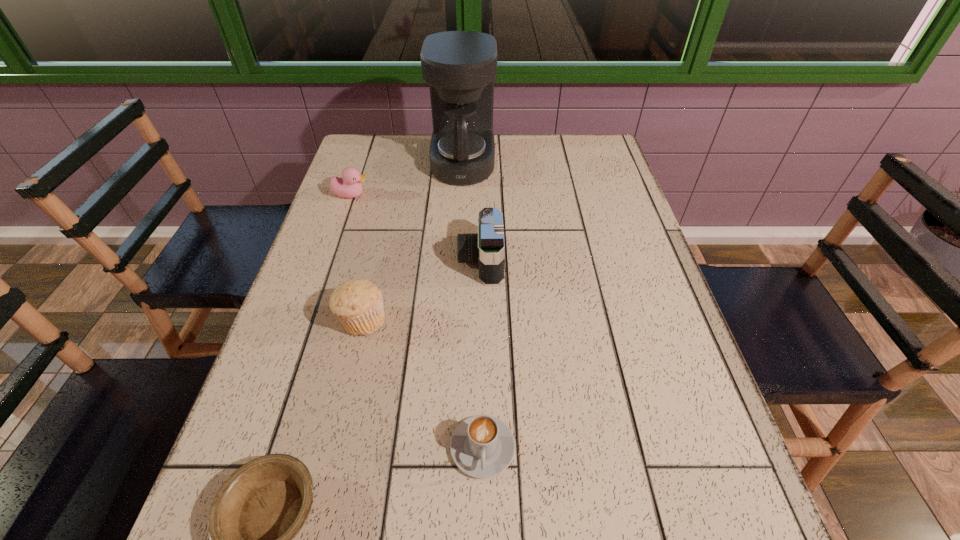
In the image, there is a desktop. Identify the location of free space at the far right corner. Image resolution: width=960 pixels, height=540 pixels. (x=600, y=143).

You are a GUI agent. You are given a task and a screenshot of the screen. Output one action in this format:
    pyautogui.click(x=<x>, y=<y>)
    Task: Click on the free spot between the fifth nearest object and the cappuccino
    Image resolution: width=960 pixels, height=540 pixels.
    Given the screenshot: What is the action you would take?
    pyautogui.click(x=417, y=321)

Identify the location of blank region between the third nearest object and the camera. The width and height of the screenshot is (960, 540). (421, 290).

Find the location of a particular element. The width and height of the screenshot is (960, 540). vacant point located between the muffin and the coffee maker is located at coordinates (413, 242).

At what (x,y) coordinates should I click in order to perform the action: click on free area in between the third nearest object and the camera. Please return your answer as a coordinate pair (x, y). The image size is (960, 540). Looking at the image, I should click on (421, 290).

Image resolution: width=960 pixels, height=540 pixels. I want to click on free space between the third nearest object and the camera, so click(x=421, y=290).

Where is `object that is the closest to the muffin`? The width and height of the screenshot is (960, 540). object that is the closest to the muffin is located at coordinates (487, 247).

Identify which object is located as the second nearest to the muffin. Please provide its 2D coordinates. Your answer should be formatted as a tuple, i.e. [(x, y)], where the tuple contains the x and y coordinates of a point satisfying the conditions above.

[(482, 446)]

Locate an element on the screen. vacant space that satisfies the following two spatial constraints: 1. on the front-facing side of the fourth nearest object; 2. on the front side of the muffin is located at coordinates (481, 320).